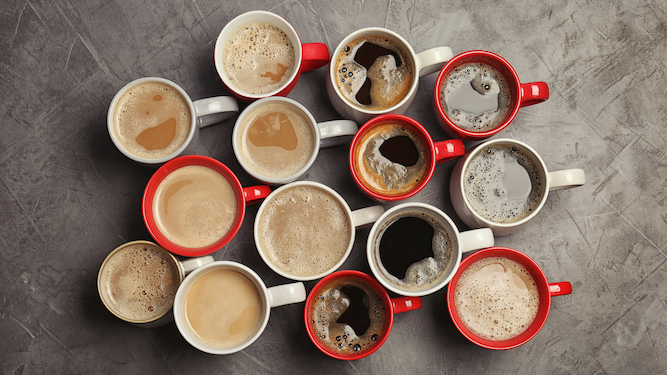
Locate an element on the screen. red mugs is located at coordinates (185, 204), (271, 57), (478, 91), (394, 162), (351, 325), (468, 310).